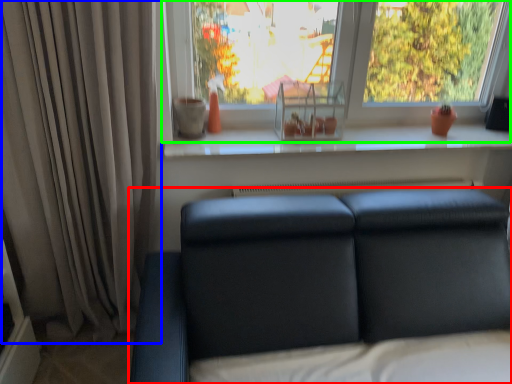
Question: Which object is the closest to the studio couch (highlighted by a red box)? Choose among these: curtain (highlighted by a blue box) or window (highlighted by a green box).

Choices:
 (A) curtain
 (B) window

Answer: (A)